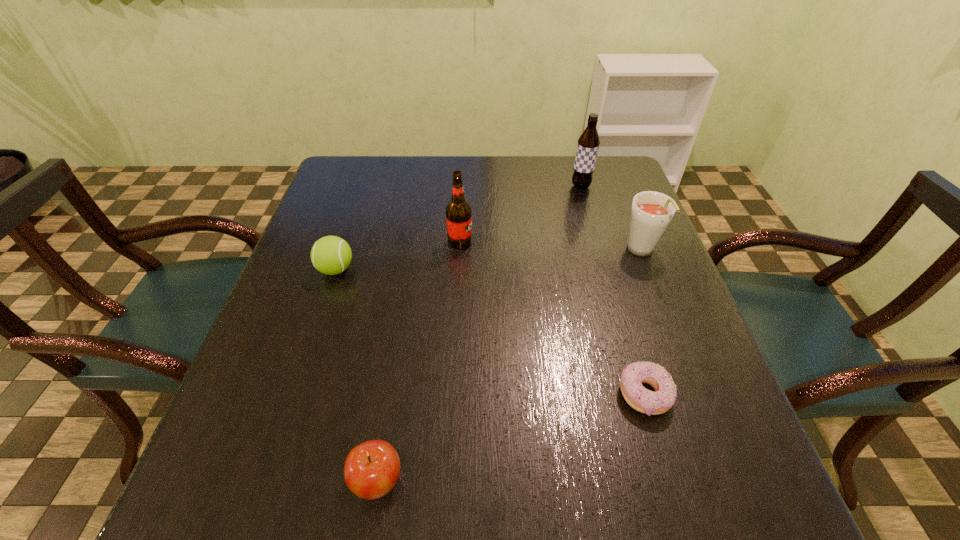
Image resolution: width=960 pixels, height=540 pixels. I want to click on vacant space at the far edge of the desktop, so click(x=431, y=183).

This screenshot has height=540, width=960. Find the location of `vacant space at the near edge of the desktop`. vacant space at the near edge of the desktop is located at coordinates (610, 502).

Locate an element on the screen. free spot at the left edge of the desktop is located at coordinates (351, 242).

In the image, there is a desktop. What are the coordinates of `vacant space at the right edge` in the screenshot? It's located at (638, 335).

In the image, there is a desktop. Find the location of `vacant space at the far left corner`. vacant space at the far left corner is located at coordinates (335, 180).

Image resolution: width=960 pixels, height=540 pixels. Identify the location of free region at the near right corner of the desktop. (756, 497).

The height and width of the screenshot is (540, 960). I want to click on vacant area between the fifth farthest object and the second object from left to right, so pos(511,437).

This screenshot has width=960, height=540. What are the coordinates of `vacant space in between the rightmost root beer and the leftmost root beer` in the screenshot? It's located at (551, 247).

Where is `free space between the apple and the doughnut`? free space between the apple and the doughnut is located at coordinates (511, 437).

In order to click on vacant space that is in between the fifth farthest object and the apple in this screenshot , I will do `click(511, 437)`.